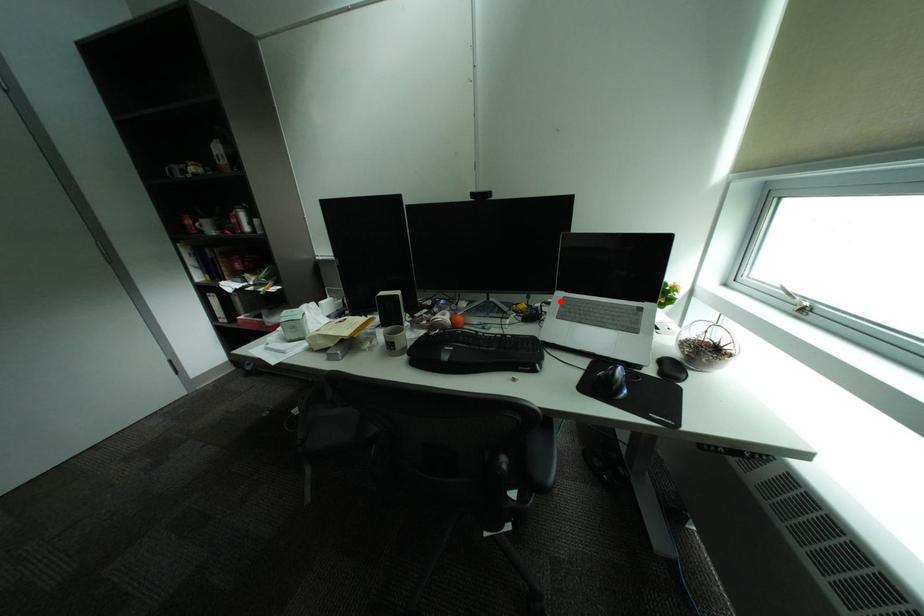
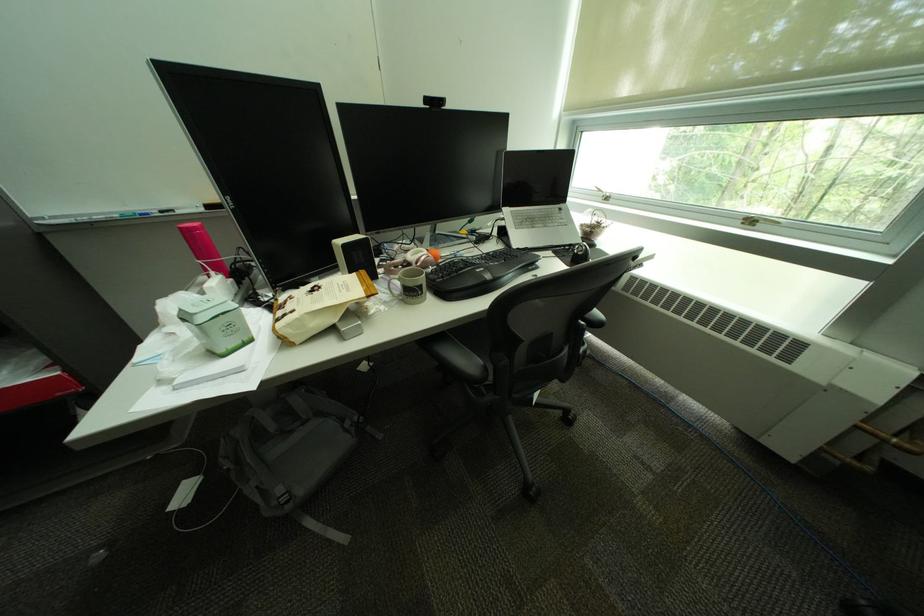
Question: A red point is marked in image1. In image2, is the corresponding 3D point closer to the camera or farther? Reply with the corresponding letter.

Choices:
 (A) The corresponding 3D point is closer.
 (B) The corresponding 3D point is farther.

Answer: (A)